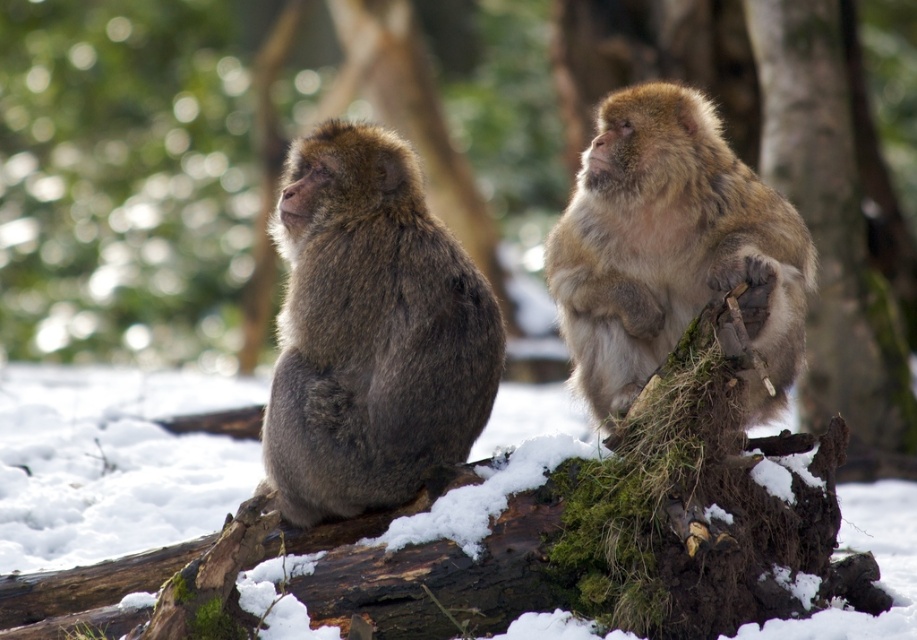
Which is below, white fluffy snow at center or brown furry monkey at upper right?

Positioned lower is white fluffy snow at center.

Which is behind, point (207, 451) or point (711, 280)?

The point (207, 451) is more distant.

I want to click on white fluffy snow at center, so click(x=112, y=461).

Does brown furry monkey at left have a smaller size compared to white fluffy snow at center?

Yes.

Is brown furry monkey at left taller than white fluffy snow at center?

Yes, brown furry monkey at left is taller than white fluffy snow at center.

Find the location of a particular element. Image resolution: width=917 pixels, height=640 pixels. brown furry monkey at left is located at coordinates (370, 332).

Find the location of a particular element. brown furry monkey at left is located at coordinates (370, 332).

The height and width of the screenshot is (640, 917). Describe the element at coordinates (370, 332) in the screenshot. I see `brown furry monkey at left` at that location.

Is brown furry monkey at left bigger than brown furry monkey at upper right?

Incorrect, brown furry monkey at left is not larger than brown furry monkey at upper right.

Does point (379, 163) come in front of point (631, 164)?

No.

Image resolution: width=917 pixels, height=640 pixels. Find the location of `brown furry monkey at left`. brown furry monkey at left is located at coordinates click(x=370, y=332).